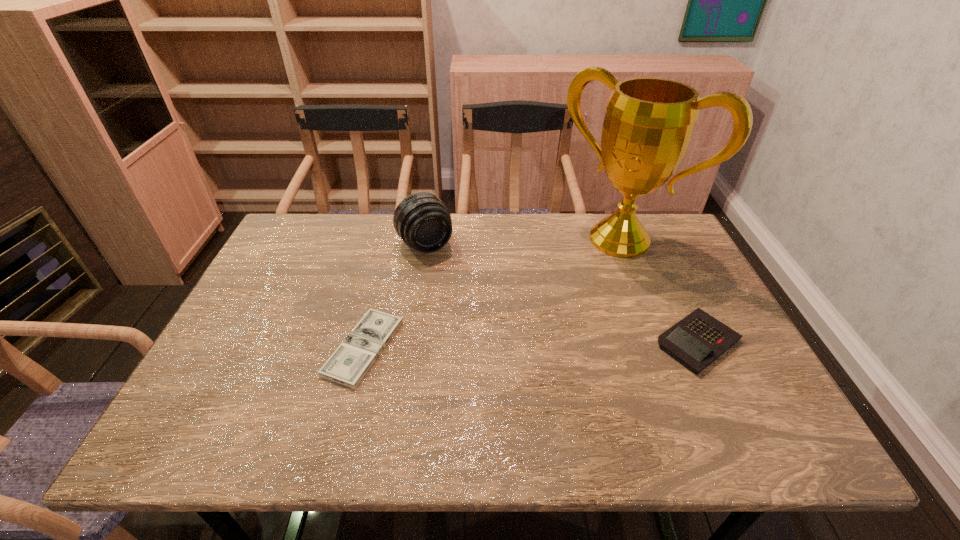
You are a GUI agent. You are given a task and a screenshot of the screen. Output one action in this format:
    pyautogui.click(x=<x>, y=<y>)
    Task: Click on the shortest object
    The height and width of the screenshot is (540, 960).
    Given the screenshot: What is the action you would take?
    pyautogui.click(x=349, y=363)

Find the location of a particular element. calculator is located at coordinates (697, 340).

Where is `award`? Image resolution: width=960 pixels, height=540 pixels. award is located at coordinates (649, 122).

Locate an element on the screen. Image resolution: width=960 pixels, height=540 pixels. telephoto lens is located at coordinates (422, 220).

This screenshot has width=960, height=540. Identify the location of free space located on the left of the dollar. (257, 347).

Image resolution: width=960 pixels, height=540 pixels. I want to click on vacant region located on the back of the calculator, so click(x=677, y=296).

This screenshot has width=960, height=540. I want to click on free space located 0.140m on the front-facing side of the tallest object, so (x=565, y=291).

In order to click on blank space located on the front-facing side of the tallest object in this screenshot , I will do `click(516, 344)`.

This screenshot has width=960, height=540. I want to click on free space located 0.080m on the front-facing side of the tallest object, so click(x=576, y=279).

You are a GUI agent. You are given a task and a screenshot of the screen. Output one action in this format:
    pyautogui.click(x=<x>, y=<y>)
    Task: Click on the free point located at the front element of the third shortest object
    
    Given the screenshot: What is the action you would take?
    pyautogui.click(x=468, y=308)